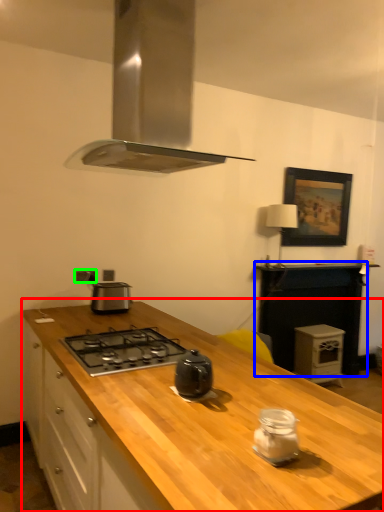
Question: Which object is positioned closest to countertop (highlighted by a red box)? Select from counter top (highlighted by a blue box) and electric outlet (highlighted by a green box).

Choices:
 (A) counter top
 (B) electric outlet

Answer: (B)